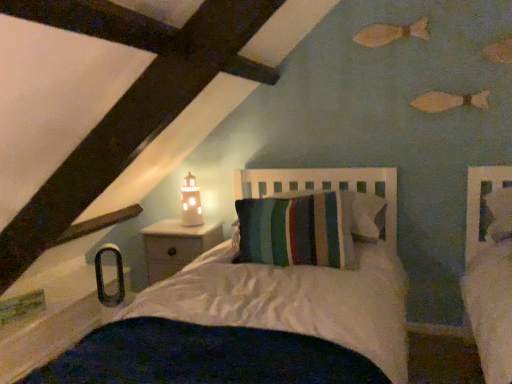
You are a GUI agent. You are given a task and a screenshot of the screen. Output one action in this format:
    pyautogui.click(x=<x>, y=<y>)
    Task: Click on the vacant area that lies to the right of matte white lighthouse at upper center
    
    Given the screenshot: What is the action you would take?
    pyautogui.click(x=211, y=227)